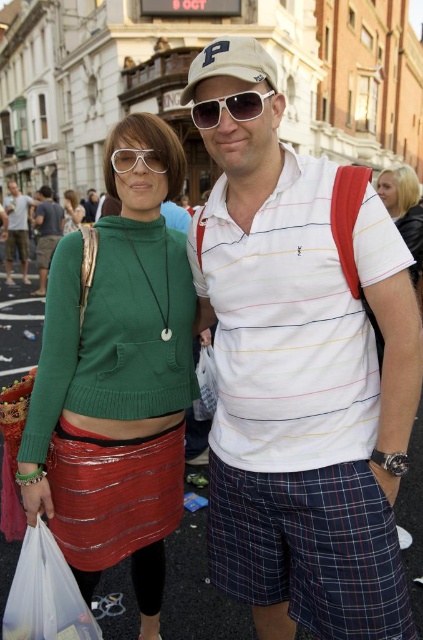
You are a photographer trying to capture a candid shot of the blonde hair at upper right without including the matte black shorts at lower left in the frame. Based on their positions, is this possible?

Yes, since the blonde hair at upper right is in front of the matte black shorts at lower left, you can position your camera to focus on the blonde hair while excluding the matte black shorts by adjusting the angle or zoom.

In the scene shown: You are standing in a public area and see the shiny red skirt at lower left. If you want to locate it precisely on a coordinate system where the bottom left corner is the origin, what are its coordinates?

The coordinates of the shiny red skirt at lower left are at point (x=112, y=493).

You are a photographer trying to capture a candid shot of the blonde hair at upper right and the matte black shorts at lower left. Which object should you focus on first if you want to include both in the frame without moving the camera?

You should focus on the matte black shorts at lower left first because it occupies more space than the blonde hair at upper right, so it will be easier to frame both objects by centering the larger one first.